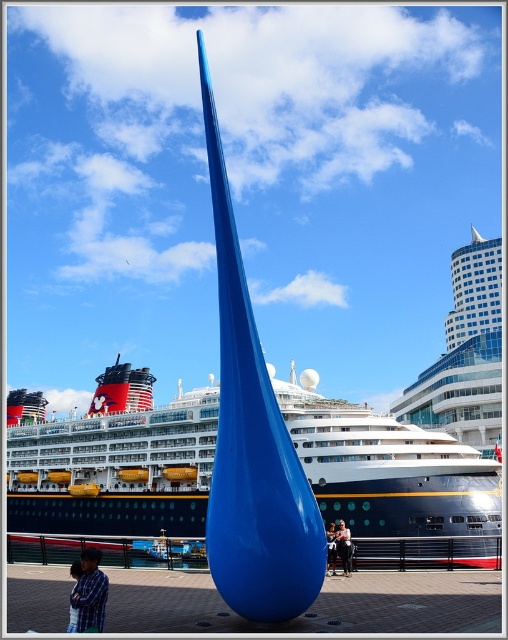
Question: Based on their relative distances, which object is nearer to the smooth skin person at center?

Choices:
 (A) matte blue sculpture at center
 (B) plaid shirt at lower left

Answer: (A)

Question: Does smooth skin person at center appear under matte blue sculpture at center?

Choices:
 (A) yes
 (B) no

Answer: (A)

Question: Which object appears closest to the camera in this image?

Choices:
 (A) shiny blue ship at center
 (B) plaid shirt at lower left

Answer: (B)

Question: Is shiny blue ship at center smaller than matte blue sculpture at center?

Choices:
 (A) no
 (B) yes

Answer: (A)

Question: Which point is closer to the camera?

Choices:
 (A) (334, 536)
 (B) (332, 545)

Answer: (B)

Question: Considering the relative positions of smooth skin person at center and matte blue sculpture at center in the image provided, where is smooth skin person at center located with respect to matte blue sculpture at center?

Choices:
 (A) right
 (B) left

Answer: (A)